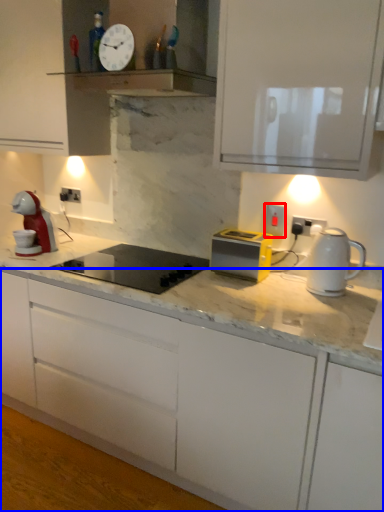
Question: Which object appears closest to the camera in this image, electric outlet (highlighted by a red box) or cabinetry (highlighted by a blue box)?

Choices:
 (A) electric outlet
 (B) cabinetry

Answer: (B)